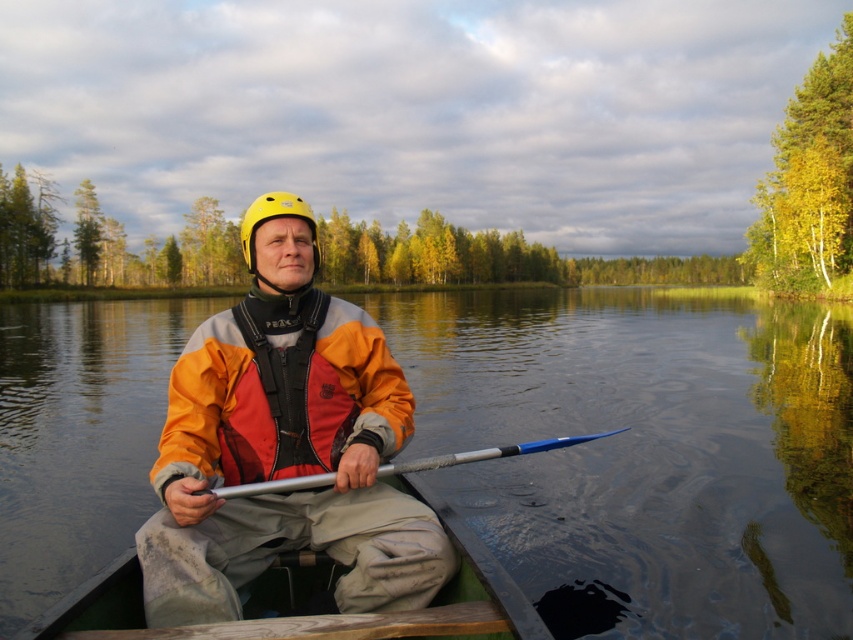
Question: Which of these objects is positioned closest to the yellow matte helmet at center?

Choices:
 (A) silver metallic paddle at center
 (B) orange matte jacket at center
 (C) orange fabric life jacket at center

Answer: (B)

Question: Can you confirm if orange fabric life jacket at center is positioned below orange matte jacket at center?

Choices:
 (A) yes
 (B) no

Answer: (A)

Question: In this image, where is transparent water at center located relative to orange matte jacket at center?

Choices:
 (A) right
 (B) left

Answer: (B)

Question: Which object is farther from the camera taking this photo?

Choices:
 (A) orange matte jacket at center
 (B) orange fabric life jacket at center
 (C) transparent water at center
 (D) yellow matte helmet at center

Answer: (D)

Question: Does transparent water at center have a lesser width compared to orange fabric life jacket at center?

Choices:
 (A) no
 (B) yes

Answer: (A)

Question: Which object is the closest to the silver metallic paddle at center?

Choices:
 (A) yellow matte helmet at center
 (B) transparent water at center
 (C) wooden canoe at center
 (D) orange fabric life jacket at center

Answer: (A)